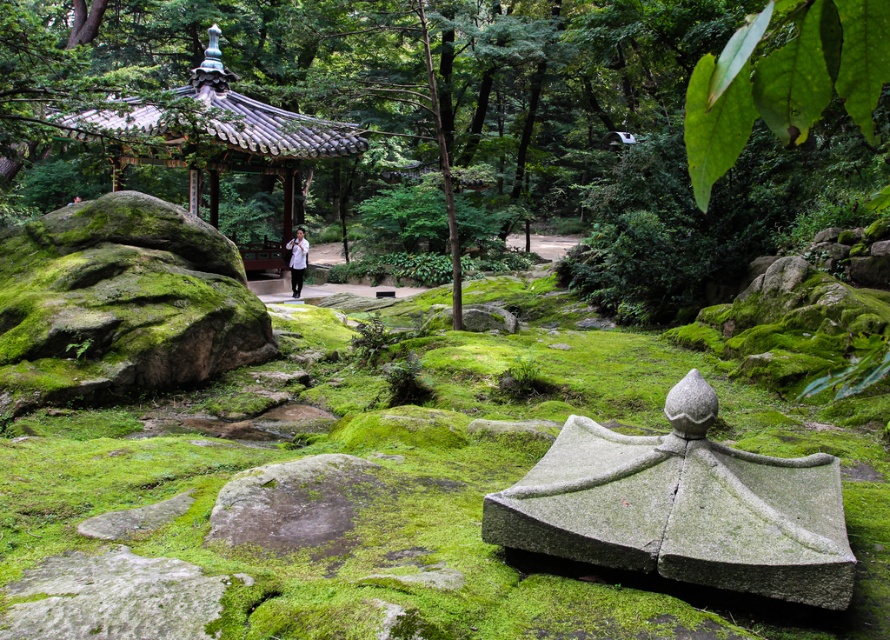
From the picture: Does green mossy rock at center appear on the right side of shiny dark gray gazebo at center?

Correct, you'll find green mossy rock at center to the right of shiny dark gray gazebo at center.

The height and width of the screenshot is (640, 890). What do you see at coordinates (473, 122) in the screenshot? I see `green mossy rock at center` at bounding box center [473, 122].

Identify the location of green mossy rock at center. (473, 122).

Is point (539, 12) in front of point (293, 244)?

No.

Is green mossy rock at center positioned before white matte shirt at center?

Yes.

This screenshot has height=640, width=890. I want to click on green mossy rock at center, so click(x=473, y=122).

Is the position of shiny dark gray gazebo at center more distant than that of white matte shirt at center?

No, shiny dark gray gazebo at center is in front of white matte shirt at center.

Is point (182, 108) positioned before point (292, 282)?

Yes, it is.

Is point (116, 109) closer to viewer compared to point (293, 291)?

That is True.

This screenshot has width=890, height=640. I want to click on shiny dark gray gazebo at center, so [x=217, y=140].